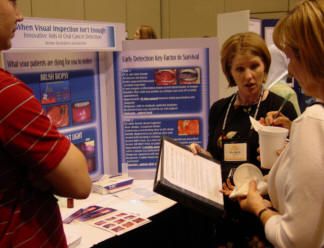
Locate an element on the screen. The width and height of the screenshot is (324, 248). wall is located at coordinates (115, 13).